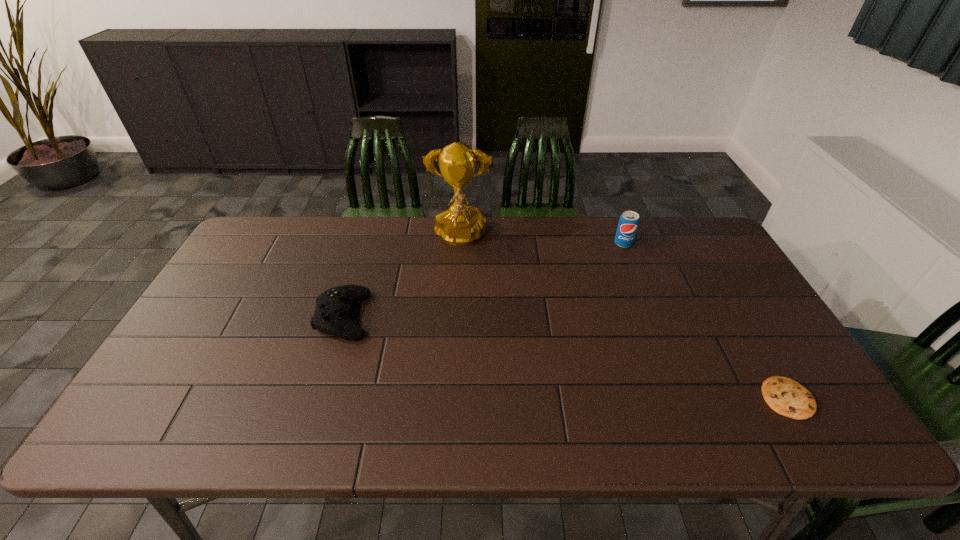
Where is `the closest object to the control`? the closest object to the control is located at coordinates (459, 225).

Locate which object ranks second in proximity to the tallest object. Please provide its 2D coordinates. Your answer should be formatted as a tuple, i.e. [(x, y)], where the tuple contains the x and y coordinates of a point satisfying the conditions above.

[(628, 223)]

Locate an element on the screen. free space that satisfies the following two spatial constraints: 1. on the front side of the soda can; 2. on the right side of the tallest object is located at coordinates (459, 244).

The height and width of the screenshot is (540, 960). I want to click on vacant space that satisfies the following two spatial constraints: 1. on the front side of the second object from left to right; 2. on the left side of the second tallest object, so click(x=459, y=244).

Find the location of `free space that satisfies the following two spatial constraints: 1. on the front side of the third object from left to right; 2. on the left side of the second object from left to right`. free space that satisfies the following two spatial constraints: 1. on the front side of the third object from left to right; 2. on the left side of the second object from left to right is located at coordinates (459, 244).

The image size is (960, 540). Identify the location of free space that satisfies the following two spatial constraints: 1. on the front side of the second object from left to right; 2. on the right side of the cookie. (450, 398).

Image resolution: width=960 pixels, height=540 pixels. Find the location of `vacant space that satisfies the following two spatial constraints: 1. on the front side of the cookie; 2. on the left side of the third farthest object`. vacant space that satisfies the following two spatial constraints: 1. on the front side of the cookie; 2. on the left side of the third farthest object is located at coordinates (318, 398).